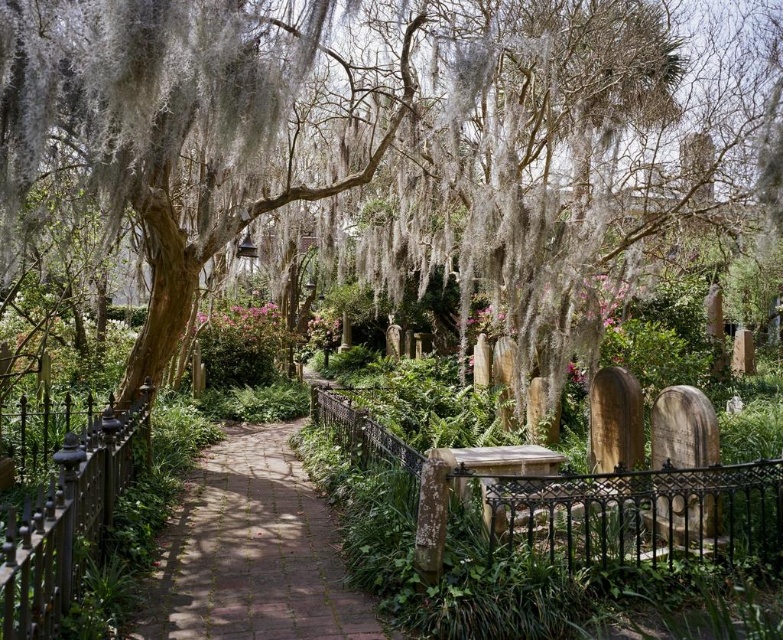
You are a gardener planning to trim the green mossy tree at center so that it doesn not overhang the brick paved path at center. Based on the scene description, can you determine if the tree is wider than the path?

The green mossy tree at center might be wider than brick paved path at center according to the description, so there is a possibility that trimming is needed to prevent overhanging.

You are standing on the brick paved path at center and want to reach the black wrought iron fence at center. Which direction should you move to get there?

The brick paved path at center is to the left of black wrought iron fence at center, so you should move to the right to reach the black wrought iron fence at center.

You are standing at the entrance of the cemetery and want to reach a specific point marked as point (327, 516). Given that the pathway is 2 meters wide, can you walk directly to that point without stepping off the path?

The distance between you and point (327, 516) is 6.11 meters. Since the pathway is 2 meters wide, you can walk directly to the point without stepping off the path as long as the point lies within the pathway boundaries.